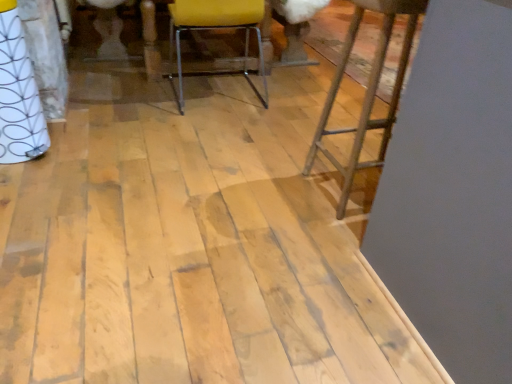
You are a GUI agent. You are given a task and a screenshot of the screen. Output one action in this format:
    pyautogui.click(x=<x>, y=<y>)
    Task: Click on the rustic wood stool at right
    The image size is (512, 384).
    Given the screenshot: What is the action you would take?
    pyautogui.click(x=367, y=89)

The width and height of the screenshot is (512, 384). Describe the element at coordinates (367, 89) in the screenshot. I see `rustic wood stool at right` at that location.

This screenshot has height=384, width=512. Find the location of `yellow fabric chair at center`. yellow fabric chair at center is located at coordinates (216, 28).

Describe the element at coordinates (216, 28) in the screenshot. The height and width of the screenshot is (384, 512). I see `yellow fabric chair at center` at that location.

Measure the distance between yellow fabric chair at center and camera.

They are 6.95 feet apart.

What is the approximate height of yellow fabric chair at center?

It is 23.41 inches.

Identify the location of rustic wood stool at right. [x=367, y=89].

Which object is positioned more to the left, yellow fabric chair at center or rustic wood stool at right?

yellow fabric chair at center is more to the left.

Considering the positions of objects yellow fabric chair at center and rustic wood stool at right in the image provided, who is in front, yellow fabric chair at center or rustic wood stool at right?

rustic wood stool at right is in front.

Is point (263, 16) farther from viewer compared to point (379, 158)?

Yes, it is.

From the image's perspective, would you say yellow fabric chair at center is shown under rustic wood stool at right?

No.

From a real-world perspective, which is physically above, yellow fabric chair at center or rustic wood stool at right?

In real-world perspective, rustic wood stool at right is above.

Based on the photo, looking at their sizes, would you say yellow fabric chair at center is wider or thinner than rustic wood stool at right?

Considering their sizes, yellow fabric chair at center looks broader than rustic wood stool at right.

From their relative heights in the image, would you say yellow fabric chair at center is taller or shorter than rustic wood stool at right?

Clearly, yellow fabric chair at center is shorter compared to rustic wood stool at right.

Is yellow fabric chair at center bigger than rustic wood stool at right?

Yes.

Is yellow fabric chair at center positioned beyond the bounds of rustic wood stool at right?

Yes, yellow fabric chair at center is not within rustic wood stool at right.

Is yellow fabric chair at center far from rustic wood stool at right?

That's not correct — yellow fabric chair at center is a little close to rustic wood stool at right.

Is yellow fabric chair at center facing towards rustic wood stool at right?

No, yellow fabric chair at center is not facing towards rustic wood stool at right.

How many degrees apart are the facing directions of yellow fabric chair at center and rustic wood stool at right?

The angle between the facing direction of yellow fabric chair at center and the facing direction of rustic wood stool at right is 178 degrees.

How distant is yellow fabric chair at center from rustic wood stool at right?

34.54 inches.

Locate an element on the screen. The image size is (512, 384). furniture lying on the right of yellow fabric chair at center is located at coordinates (367, 89).

Which is more to the left, rustic wood stool at right or yellow fabric chair at center?

yellow fabric chair at center is more to the left.

Is the position of rustic wood stool at right more distant than that of yellow fabric chair at center?

No.

Does point (380, 8) appear closer or farther from the camera than point (259, 96)?

Point (380, 8) is closer to the camera than point (259, 96).

From the image's perspective, is rustic wood stool at right on yellow fabric chair at center?

Incorrect, from the image's perspective, rustic wood stool at right is lower than yellow fabric chair at center.

Looking at this image, from a real-world perspective, is rustic wood stool at right positioned under yellow fabric chair at center based on gravity?

No, from a real-world perspective, rustic wood stool at right is not below yellow fabric chair at center.

Considering the relative sizes of rustic wood stool at right and yellow fabric chair at center in the image provided, is rustic wood stool at right wider than yellow fabric chair at center?

Incorrect, the width of rustic wood stool at right does not surpass that of yellow fabric chair at center.

Which of these two, rustic wood stool at right or yellow fabric chair at center, stands shorter?

yellow fabric chair at center is shorter.

Which of these two, rustic wood stool at right or yellow fabric chair at center, is smaller?

rustic wood stool at right is smaller.

Would you say rustic wood stool at right is outside yellow fabric chair at center?

Yes, rustic wood stool at right is outside of yellow fabric chair at center.

Based on the photo, are rustic wood stool at right and yellow fabric chair at center located far from each other?

No, rustic wood stool at right is not far away from yellow fabric chair at center.

Is rustic wood stool at right oriented towards yellow fabric chair at center?

No, rustic wood stool at right is not oriented towards yellow fabric chair at center.

Can you tell me how much rustic wood stool at right and yellow fabric chair at center differ in facing direction?

178 degrees separate the facing orientations of rustic wood stool at right and yellow fabric chair at center.

Locate an element on the screen. furniture below the yellow fabric chair at center (from the image's perspective) is located at coordinates (367, 89).

Identify the location of chair lying above the rustic wood stool at right (from the image's perspective). The width and height of the screenshot is (512, 384). (216, 28).

Where is `chair behind the rustic wood stool at right`? This screenshot has height=384, width=512. chair behind the rustic wood stool at right is located at coordinates (216, 28).